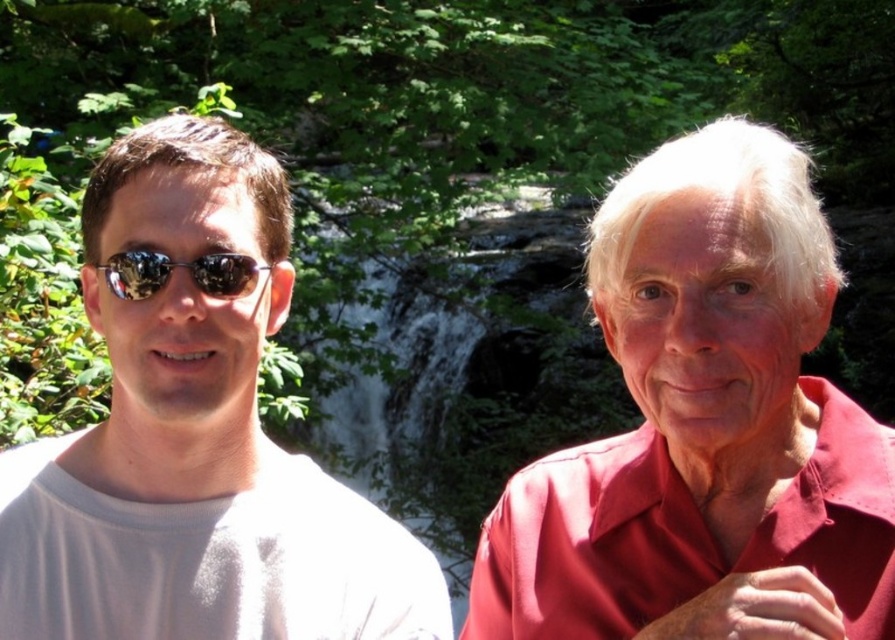
You are a photographer adjusting the camera focus. You need to ensure both the matte red shirt at center and the sunglasses at left are in focus. Which object should you focus on first to account for their size difference?

The matte red shirt at center has a greater height compared to sunglasses at left, so you should focus on the matte red shirt at center first since it is larger and requires more precise focus.

You are a photographer taking a picture of two people in front of a waterfall. You notice the white matte shirt at left and the sunglasses at left. Which object is more to the left?

The white matte shirt at left is more on the left side than the sunglasses at left because the white matte shirt at left is positioned on the left side of sunglasses at left.